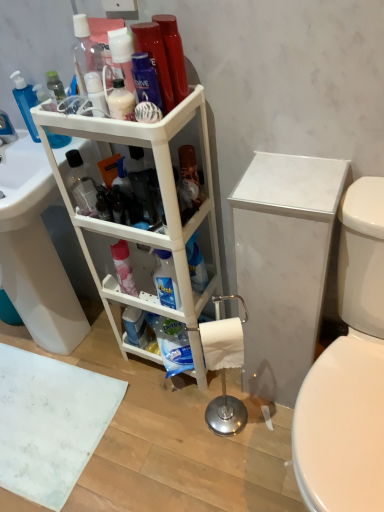
The height and width of the screenshot is (512, 384). I want to click on vacant space in front of white plastic shelf at center, so click(x=163, y=429).